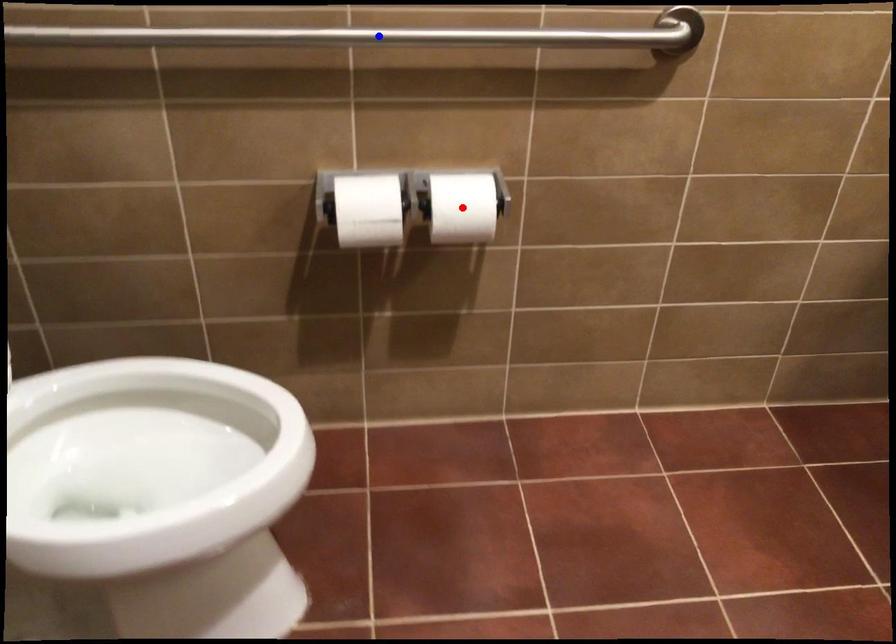
Question: Two points are marked on the image. Which point is closer to the camera?

Choices:
 (A) Blue point is closer.
 (B) Red point is closer.

Answer: (A)